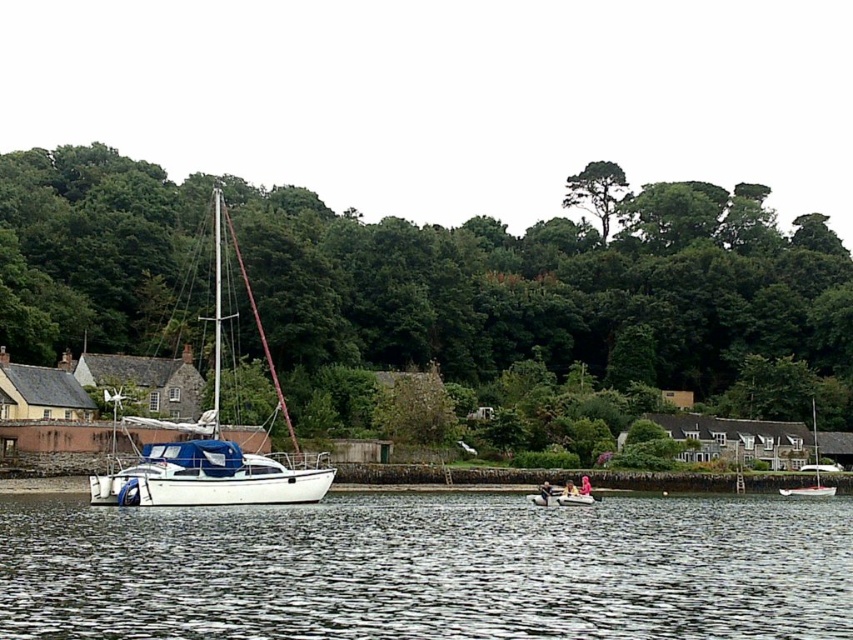
You are standing on the riverside and see both the white matte sailboat at left and the white glossy sailboat at right. Which boat is closer to your left side?

The white matte sailboat at left is closer to your left side because it is positioned to the left of the white glossy sailboat at right.

You are standing on the riverbank and want to board the white glossy sailboat at right and the white plastic kayak at center. Which vessel will you reach first if you walk straight towards them?

You will reach the white glossy sailboat at right first because it is closer to you than the white plastic kayak at center.

In the scene shown: You are standing on a bridge that is 60 meters away from the white matte sailboat at left. Can you safely walk towards it without getting too close?

The white matte sailboat at left is 59.56 meters away from the viewer. Since the bridge is 60 meters away from the boat, walking towards it would bring you closer. However, the distance between you and the boat would decrease, so you might get too close depending on how far you walk. To stay at least 60 meters away, you should not approach beyond your current position on the bridge.